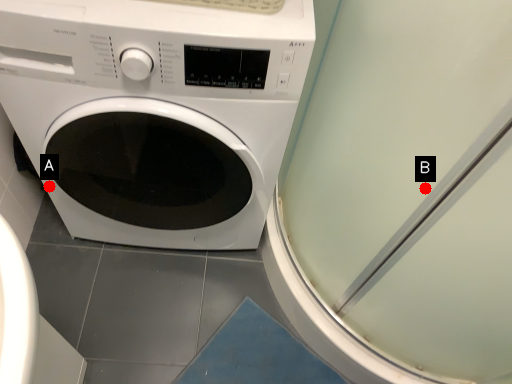
Question: Two points are circled on the image, labeled by A and B beside each circle. Which point is farther to the camera?

Choices:
 (A) A is further
 (B) B is further

Answer: (A)